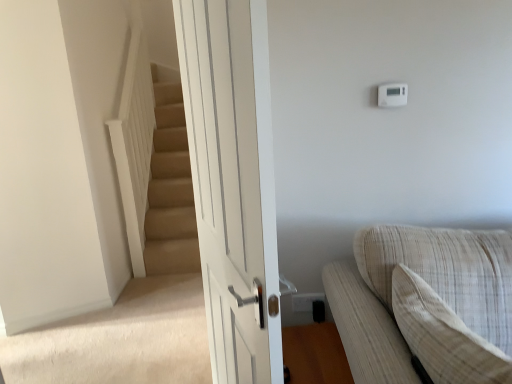
Locate an element on the screen. This screenshot has width=512, height=384. light beige textured pillow at right is located at coordinates (443, 336).

Locate an element on the screen. white plastic electric outlet at lower right is located at coordinates (305, 301).

At what (x,y) coordinates should I click in order to perform the action: click on white plastic thermostat at upper right. Please return your answer as a coordinate pair (x, y). Looking at the image, I should click on [392, 95].

From a real-world perspective, who is located higher, light beige textured pillow at right or white plastic thermostat at upper right?

white plastic thermostat at upper right is physically above.

In the scene shown: Which is behind, light beige textured pillow at right or white plastic thermostat at upper right?

white plastic thermostat at upper right is further away from the camera.

How many degrees apart are the facing directions of light beige textured pillow at right and white plastic thermostat at upper right?

They differ by 89.4 degrees in their facing directions.

Is light beige textured pillow at right thinner than white plastic thermostat at upper right?

In fact, light beige textured pillow at right might be wider than white plastic thermostat at upper right.

From a real-world perspective, is light beige textured pillow at right under beige textured couch at lower right?

No, from a real-world perspective, light beige textured pillow at right is not below beige textured couch at lower right.

Does point (462, 331) lie in front of point (481, 299)?

Yes.

Between light beige textured pillow at right and beige textured couch at lower right, which one has smaller size?

light beige textured pillow at right.

Is light beige textured pillow at right spatially inside beige textured couch at lower right, or outside of it?

light beige textured pillow at right is located inside beige textured couch at lower right.

Is white glossy door at center positioned with its back to beige textured couch at lower right?

Yes, white glossy door at center is positioned with its back facing beige textured couch at lower right.

Does point (217, 161) come closer to viewer compared to point (505, 246)?

That is True.

Is white glossy door at center spatially inside beige textured couch at lower right, or outside of it?

white glossy door at center is outside beige textured couch at lower right.

From the picture: From the image's perspective, who appears lower, beige textured couch at lower right or white plastic thermostat at upper right?

beige textured couch at lower right appears lower in the image.

From a real-world perspective, who is located lower, beige textured couch at lower right or white plastic thermostat at upper right?

beige textured couch at lower right, from a real-world perspective.

Is beige textured couch at lower right positioned far away from white plastic thermostat at upper right?

They are positioned close to each other.

Which point is more distant from viewer, (497, 247) or (398, 83)?

The point (398, 83) is farther from the camera.

Is white glossy door at center next to white plastic electric outlet at lower right?

No, white glossy door at center is not touching white plastic electric outlet at lower right.

Looking at this image, considering the sizes of objects white glossy door at center and white plastic electric outlet at lower right in the image provided, who is taller, white glossy door at center or white plastic electric outlet at lower right?

Standing taller between the two is white glossy door at center.

Looking at this image, what's the angular difference between white glossy door at center and white plastic electric outlet at lower right's facing directions?

71.9 degrees separate the facing orientations of white glossy door at center and white plastic electric outlet at lower right.

In the scene shown: Is white glossy door at center in front of or behind white plastic electric outlet at lower right in the image?

Visually, white glossy door at center is located in front of white plastic electric outlet at lower right.

Who is smaller, light beige textured pillow at right or white plastic electric outlet at lower right?

With smaller size is white plastic electric outlet at lower right.

Between light beige textured pillow at right and white plastic electric outlet at lower right, which one is positioned in front?

light beige textured pillow at right is more forward.

From a real-world perspective, relative to white plastic electric outlet at lower right, is light beige textured pillow at right vertically above or below?

From a real-world perspective, light beige textured pillow at right is physically above white plastic electric outlet at lower right.

From a real-world perspective, who is located lower, white plastic thermostat at upper right or beige textured couch at lower right?

In real-world perspective, beige textured couch at lower right is lower.

Measure the distance from white plastic thermostat at upper right to beige textured couch at lower right.

The distance of white plastic thermostat at upper right from beige textured couch at lower right is 29.47 inches.

Is point (400, 92) closer or farther from the camera than point (439, 257)?

Point (400, 92) is positioned farther from the camera compared to point (439, 257).

From the image's perspective, who appears lower, white plastic thermostat at upper right or beige textured couch at lower right?

beige textured couch at lower right appears lower in the image.

The height and width of the screenshot is (384, 512). I want to click on pillow below the white plastic thermostat at upper right (from a real-world perspective), so click(443, 336).

Find the location of a particular element. studio couch on the right side of light beige textured pillow at right is located at coordinates (425, 305).

Estimate the real-world distances between objects in this image. Which object is closer to white plastic electric outlet at lower right, white plastic thermostat at upper right or beige textured couch at lower right?

beige textured couch at lower right is closer to white plastic electric outlet at lower right.

Looking at the image, which one is located further to light beige textured pillow at right, beige textured couch at lower right or white glossy door at center?

white glossy door at center.

Which object lies further to the anchor point white plastic electric outlet at lower right, light beige textured pillow at right or beige textured couch at lower right?

The object further to white plastic electric outlet at lower right is light beige textured pillow at right.

Estimate the real-world distances between objects in this image. Which object is further from white plastic thermostat at upper right, beige textured couch at lower right or white glossy door at center?

white glossy door at center.

Consider the image. From the image, which object appears to be farther from white glossy door at center, white plastic thermostat at upper right or white plastic electric outlet at lower right?

white plastic thermostat at upper right is positioned further to the anchor white glossy door at center.

Which object lies further to the anchor point light beige textured pillow at right, white glossy door at center or white plastic thermostat at upper right?

white plastic thermostat at upper right.

Based on their spatial positions, is beige textured couch at lower right or white plastic thermostat at upper right further from white plastic electric outlet at lower right?

white plastic thermostat at upper right is further to white plastic electric outlet at lower right.

Which object lies nearer to the anchor point white glossy door at center, white plastic electric outlet at lower right or beige textured couch at lower right?

beige textured couch at lower right lies closer to white glossy door at center than the other object.

Locate an element on the screen. pillow located between white glossy door at center and white plastic electric outlet at lower right in the depth direction is located at coordinates (443, 336).

I want to click on studio couch between white glossy door at center and white plastic electric outlet at lower right in the front-back direction, so click(x=425, y=305).

Image resolution: width=512 pixels, height=384 pixels. I want to click on light switch located between beige textured couch at lower right and white plastic electric outlet at lower right in the depth direction, so click(392, 95).

Find the location of `pillow between white glossy door at center and beige textured couch at lower right in the horizontal direction`. pillow between white glossy door at center and beige textured couch at lower right in the horizontal direction is located at coordinates (443, 336).